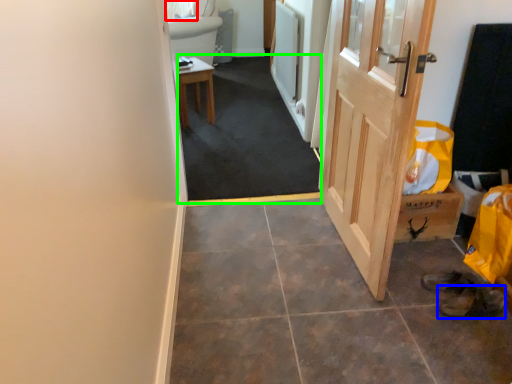
Question: Considering the real-world distances, which object is farthest from curtain (highlighted by a red box)? shoe (highlighted by a blue box) or corridor (highlighted by a green box)?

Choices:
 (A) shoe
 (B) corridor

Answer: (A)